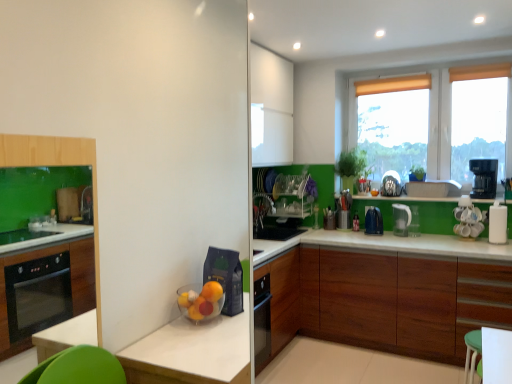
Locate an element on the screen. This screenshot has width=512, height=384. free space in front of clear plastic pitcher at upper right, which is the 2th kitchen appliance from left to right is located at coordinates 414,241.